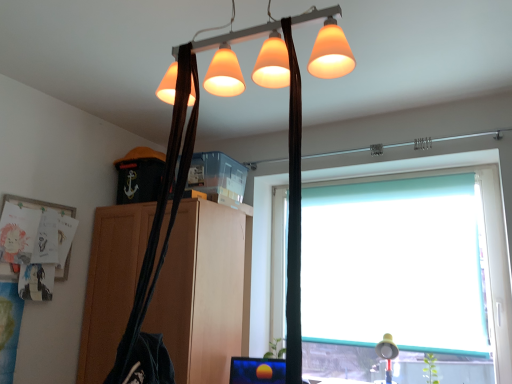
Question: Is wooden cabinet at center facing away from teal roller blind at right?

Choices:
 (A) yes
 (B) no

Answer: (B)

Question: From a real-world perspective, is wooden cabinet at center over teal roller blind at right?

Choices:
 (A) yes
 (B) no

Answer: (B)

Question: Can you confirm if wooden cabinet at center is taller than teal roller blind at right?

Choices:
 (A) no
 (B) yes

Answer: (B)

Question: Considering the relative sizes of wooden cabinet at center and teal roller blind at right in the image provided, is wooden cabinet at center thinner than teal roller blind at right?

Choices:
 (A) yes
 (B) no

Answer: (B)

Question: Is wooden cabinet at center beside teal roller blind at right?

Choices:
 (A) no
 (B) yes

Answer: (A)

Question: From their relative heights in the image, would you say matte white lampshade at lower right is taller or shorter than wooden cabinet at center?

Choices:
 (A) tall
 (B) short

Answer: (B)

Question: Is point (389, 347) positioned closer to the camera than point (152, 208)?

Choices:
 (A) closer
 (B) farther

Answer: (A)

Question: Which is correct: matte white lampshade at lower right is inside wooden cabinet at center, or outside of it?

Choices:
 (A) outside
 (B) inside

Answer: (A)

Question: From a real-world perspective, relative to wooden cabinet at center, is matte white lampshade at lower right vertically above or below?

Choices:
 (A) below
 (B) above

Answer: (A)

Question: Is teal roller blind at right spatially inside matte orange lampshade at upper center, or outside of it?

Choices:
 (A) inside
 (B) outside

Answer: (B)

Question: From the image's perspective, is teal roller blind at right located above or below matte orange lampshade at upper center?

Choices:
 (A) below
 (B) above

Answer: (A)

Question: From a real-world perspective, relative to matte orange lampshade at upper center, is teal roller blind at right vertically above or below?

Choices:
 (A) below
 (B) above

Answer: (A)

Question: Visually, is teal roller blind at right positioned to the left or to the right of matte orange lampshade at upper center?

Choices:
 (A) left
 (B) right

Answer: (B)

Question: Choose the correct answer: Is matte white lampshade at lower right inside teal roller blind at right or outside it?

Choices:
 (A) inside
 (B) outside

Answer: (B)

Question: From the image's perspective, is matte white lampshade at lower right located above or below teal roller blind at right?

Choices:
 (A) below
 (B) above

Answer: (A)